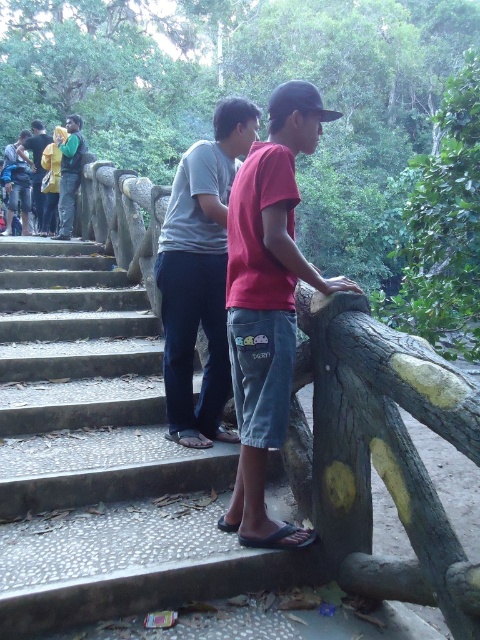
Question: Does matte red t-shirt at center appear over yellow-green shirt at left?

Choices:
 (A) yes
 (B) no

Answer: (B)

Question: Estimate the real-world distances between objects in this image. Which object is closer to the concrete stairs at center?

Choices:
 (A) matte red t-shirt at center
 (B) yellow-green shirt at upper left
 (C) yellow-green shirt at left

Answer: (A)

Question: Is gray cotton shirt at center wider than yellow-green shirt at upper left?

Choices:
 (A) no
 (B) yes

Answer: (B)

Question: Does yellow-green shirt at upper left have a larger size compared to yellow-green shirt at left?

Choices:
 (A) yes
 (B) no

Answer: (B)

Question: Which is farther from the matte red t-shirt at center?

Choices:
 (A) yellow-green shirt at left
 (B) concrete stairs at center
 (C) yellow-green shirt at upper left

Answer: (A)

Question: Among these objects, which one is farthest from the camera?

Choices:
 (A) concrete stairs at center
 (B) gray cotton shirt at center

Answer: (B)